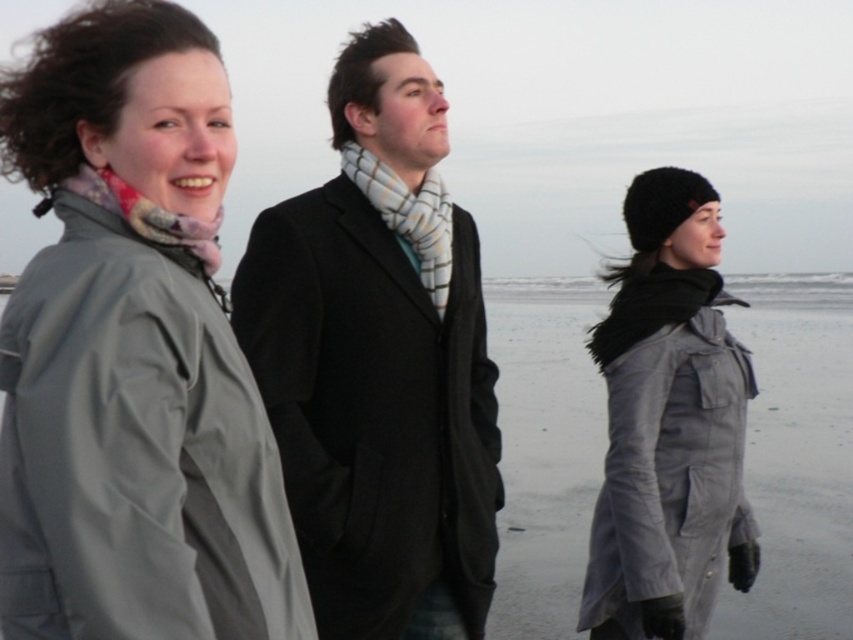
Question: Is matte gray coat at center closer to camera compared to plaid wool scarf at center?

Choices:
 (A) yes
 (B) no

Answer: (A)

Question: Does black wool coat at center come behind matte gray coat at center?

Choices:
 (A) no
 (B) yes

Answer: (A)

Question: Among these points, which one is nearest to the camera?

Choices:
 (A) (699, 593)
 (B) (457, 237)

Answer: (A)

Question: Among these objects, which one is nearest to the camera?

Choices:
 (A) plaid wool scarf at center
 (B) black wool coat at center
 (C) matte gray coat at left

Answer: (C)

Question: Based on their relative distances, which object is nearer to the matte gray coat at center?

Choices:
 (A) plaid wool scarf at center
 (B) matte gray coat at left
 (C) black wool coat at center

Answer: (C)

Question: Is black wool coat at center wider than matte gray coat at center?

Choices:
 (A) yes
 (B) no

Answer: (A)